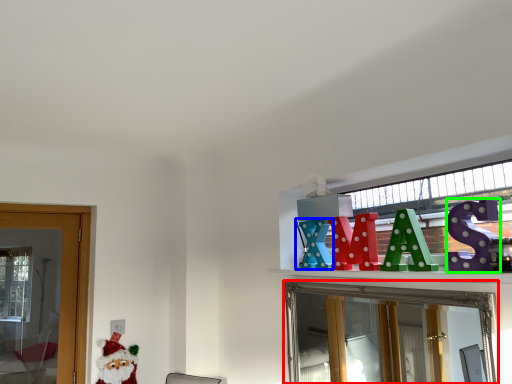
Question: Which object is positioned farthest from mirror (highlighted by a red box)? Select from toy (highlighted by a blue box) and toy (highlighted by a green box).

Choices:
 (A) toy
 (B) toy

Answer: (B)